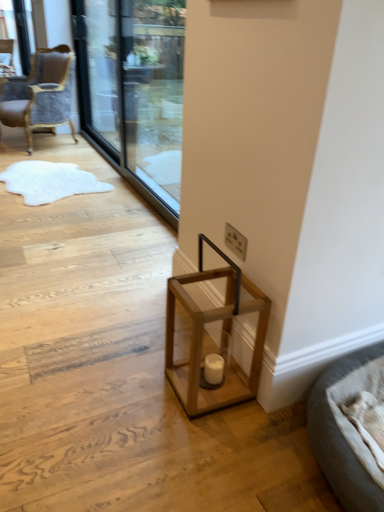
Question: Is wooden lantern at lower center in front of velvet grey chair at upper left, the 1th chair in the bottom-to-top sequence?

Choices:
 (A) no
 (B) yes

Answer: (B)

Question: Is wooden lantern at lower center at the left side of velvet grey chair at upper left, which appears as the first chair when viewed from the right?

Choices:
 (A) no
 (B) yes

Answer: (A)

Question: Is wooden lantern at lower center not within velvet grey chair at upper left, the 1th chair from the front?

Choices:
 (A) no
 (B) yes

Answer: (B)

Question: Would you say velvet grey chair at upper left, acting as the second chair starting from the left, is part of wooden lantern at lower center's contents?

Choices:
 (A) yes
 (B) no

Answer: (B)

Question: From a real-world perspective, is wooden lantern at lower center under velvet grey chair at upper left, which ranks as the second chair in back-to-front order?

Choices:
 (A) yes
 (B) no

Answer: (A)

Question: Can you confirm if wooden lantern at lower center is wider than velvet grey chair at upper left, the 1th chair in the bottom-to-top sequence?

Choices:
 (A) no
 (B) yes

Answer: (A)

Question: Considering the relative sizes of velvet upholstered chair at upper left, which ranks as the 1th chair in back-to-front order, and velvet grey chair at upper left, acting as the second chair starting from the left, in the image provided, is velvet upholstered chair at upper left, which ranks as the 1th chair in back-to-front order, shorter than velvet grey chair at upper left, acting as the second chair starting from the left,?

Choices:
 (A) yes
 (B) no

Answer: (A)

Question: Is velvet grey chair at upper left, the 2th chair in the top-to-bottom sequence, completely or partially inside velvet upholstered chair at upper left, which ranks as the first chair in left-to-right order?

Choices:
 (A) no
 (B) yes

Answer: (A)

Question: Is velvet upholstered chair at upper left, which is the second chair in right-to-left order, at the right side of velvet grey chair at upper left, which appears as the first chair when viewed from the right?

Choices:
 (A) yes
 (B) no

Answer: (B)

Question: From the image's perspective, would you say velvet upholstered chair at upper left, the second chair positioned from the front, is shown under velvet grey chair at upper left, acting as the second chair starting from the left?

Choices:
 (A) yes
 (B) no

Answer: (B)

Question: Is velvet upholstered chair at upper left, positioned as the second chair in bottom-to-top order, outside velvet grey chair at upper left, which appears as the first chair when viewed from the right?

Choices:
 (A) no
 (B) yes

Answer: (B)

Question: Is velvet upholstered chair at upper left, which is the second chair in right-to-left order, smaller than velvet grey chair at upper left, which ranks as the second chair in back-to-front order?

Choices:
 (A) no
 (B) yes

Answer: (B)

Question: From a real-world perspective, is transparent glass screen door at upper center, the 2th screen door viewed from the left, beneath velvet grey chair at upper left, which appears as the first chair when viewed from the right?

Choices:
 (A) no
 (B) yes

Answer: (A)